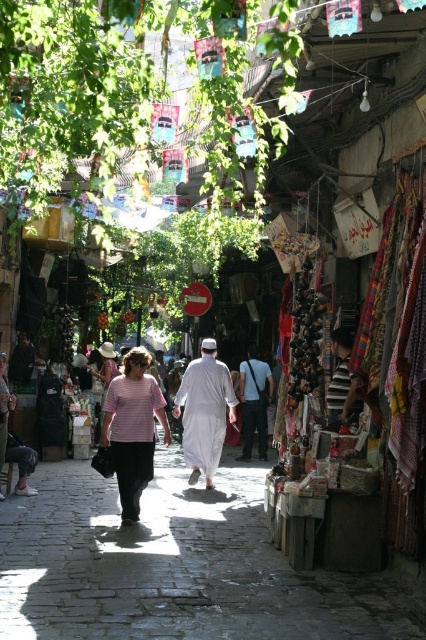
How much distance is there between dark gray fabric at center and pink fabric dress at center?

A distance of 11.17 feet exists between dark gray fabric at center and pink fabric dress at center.

Does dark gray fabric at center have a larger size compared to pink fabric dress at center?

No, dark gray fabric at center is not bigger than pink fabric dress at center.

Who is more distant from viewer, (264, 412) or (106, 371)?

The point (106, 371) is more distant.

The image size is (426, 640). I want to click on dark gray fabric at center, so click(253, 401).

Does white cotton robe at center have a smaller size compared to dark gray fabric at center?

Actually, white cotton robe at center might be larger than dark gray fabric at center.

Is point (176, 413) more distant than point (244, 385)?

No.

The image size is (426, 640). Find the location of `white cotton robe at center`. white cotton robe at center is located at coordinates (204, 412).

In order to click on white cotton robe at center in this screenshot , I will do `click(204, 412)`.

Does pink striped shirt at center have a greater width compared to pink fabric dress at center?

Yes.

Which of these two, pink striped shirt at center or pink fabric dress at center, stands shorter?

pink fabric dress at center

The image size is (426, 640). What do you see at coordinates (132, 428) in the screenshot? I see `pink striped shirt at center` at bounding box center [132, 428].

Where is `pink striped shirt at center`? This screenshot has width=426, height=640. pink striped shirt at center is located at coordinates (132, 428).